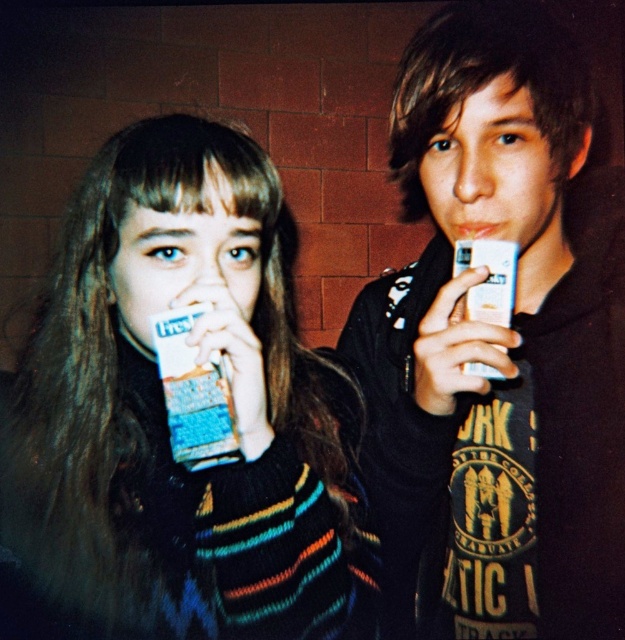
You are a photographer standing 1 meter away from the subjects. You want to take a closeup shot of the knitted sweater at left. Is the current distance sufficient to capture the sweater clearly in the photo?

The knitted sweater at left is 51.39 centimeters away from the camera. Since you are standing 1 meter away, which is 100 centimeters, the distance is sufficient to capture the sweater clearly in the photo.